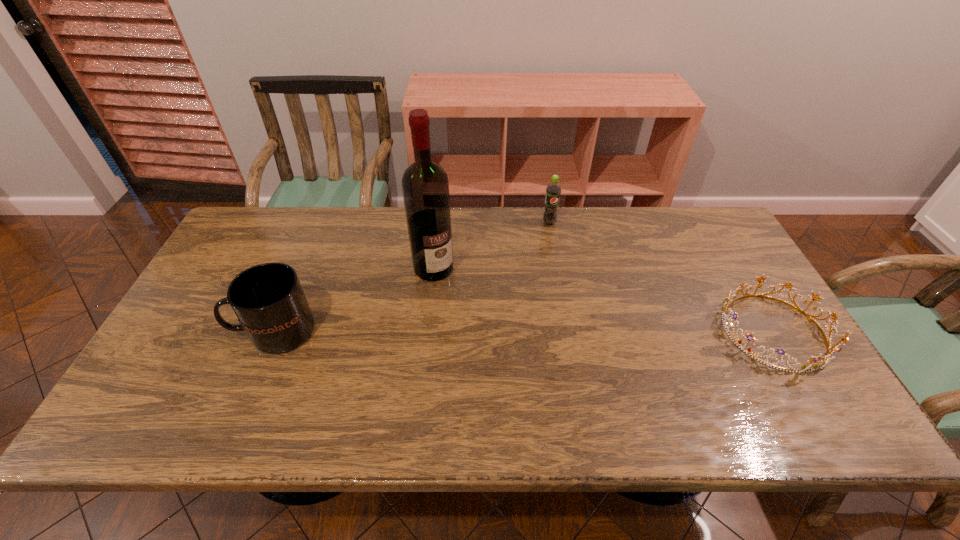
Identify the location of object that is at the near right corner. The image size is (960, 540). (811, 366).

Locate an element on the screen. The width and height of the screenshot is (960, 540). free spot at the far edge of the desktop is located at coordinates (578, 219).

Identify the location of vacant space at the near edge of the desktop. (250, 374).

Find the location of a particular element. This screenshot has height=540, width=960. vacant area at the right edge is located at coordinates 727,295.

What are the coordinates of `blank area at the far right corner` in the screenshot? It's located at (682, 215).

You are a GUI agent. You are given a task and a screenshot of the screen. Output one action in this format:
    pyautogui.click(x=<x>, y=<y>)
    Task: Click on the unoccupied position between the mug and the shortest object
    The height and width of the screenshot is (540, 960).
    Given the screenshot: What is the action you would take?
    pyautogui.click(x=525, y=331)

You are a GUI agent. You are given a task and a screenshot of the screen. Output one action in this format:
    pyautogui.click(x=<x>, y=<y>)
    Task: Click on the free point between the mug and the tallest object
    This screenshot has height=540, width=960.
    Given the screenshot: What is the action you would take?
    pyautogui.click(x=354, y=300)

Where is `free space between the mug and the alcohol`? The image size is (960, 540). free space between the mug and the alcohol is located at coordinates (354, 300).

At what (x,y) coordinates should I click in order to perform the action: click on empty space that is in between the rightmost object and the soda. Please return your answer as a coordinate pair (x, y). This screenshot has height=540, width=960. Looking at the image, I should click on (662, 277).

I want to click on unoccupied area between the tiara and the leftmost object, so click(x=525, y=331).